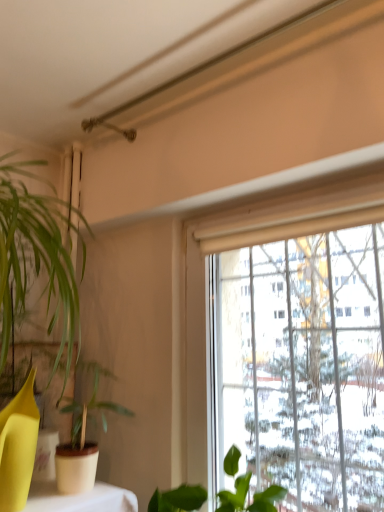
The width and height of the screenshot is (384, 512). What do you see at coordinates (82, 440) in the screenshot?
I see `green matte plant at left, the second houseplant in the right-to-left sequence` at bounding box center [82, 440].

Locate an element on the screen. green matte plant at left, the 1th houseplant positioned from the left is located at coordinates (82, 440).

What do you see at coordinates (246, 495) in the screenshot?
I see `green matte leafy plant at lower center, the first houseplant in the right-to-left sequence` at bounding box center [246, 495].

In order to face green matte leafy plant at lower center, the first houseplant in the right-to-left sequence, should I rotate leftwards or rightwards?

A 0.784 degree turn to the right will do.

Measure the distance between point (247, 509) and camera.

Point (247, 509) is 3.83 feet from camera.

What is the approximate width of green matte leafy plant at lower center, the first houseplant in the right-to-left sequence?

It is 10.95 inches.

Where is `green matte leafy plant at lower center, the first houseplant in the right-to-left sequence`? This screenshot has width=384, height=512. green matte leafy plant at lower center, the first houseplant in the right-to-left sequence is located at coordinates (246, 495).

What are the coordinates of `green matte plant at left, the second houseplant in the right-to-left sequence` in the screenshot? It's located at (82, 440).

In the scene shown: In the image, is green matte plant at left, the 1th houseplant positioned from the left, on the left side or the right side of green matte leafy plant at lower center, the first houseplant in the right-to-left sequence?

green matte plant at left, the 1th houseplant positioned from the left, is positioned on green matte leafy plant at lower center, the first houseplant in the right-to-left sequence,'s left side.

Who is more distant, green matte plant at left, the 1th houseplant positioned from the left, or green matte leafy plant at lower center, the first houseplant in the right-to-left sequence?

Positioned behind is green matte plant at left, the 1th houseplant positioned from the left.

Does point (78, 413) appear closer or farther from the camera than point (272, 490)?

Point (78, 413) is positioned farther from the camera compared to point (272, 490).

From the image's perspective, which is above, green matte plant at left, the 1th houseplant positioned from the left, or green matte leafy plant at lower center, the first houseplant in the right-to-left sequence?

green matte plant at left, the 1th houseplant positioned from the left.

Based on the photo, from a real-world perspective, does green matte plant at left, the second houseplant in the right-to-left sequence, stand above green matte leafy plant at lower center, arranged as the 2th houseplant when viewed from the left?

Yes, from a real-world perspective, green matte plant at left, the second houseplant in the right-to-left sequence, is above green matte leafy plant at lower center, arranged as the 2th houseplant when viewed from the left.

Considering the sizes of objects green matte plant at left, the second houseplant in the right-to-left sequence, and green matte leafy plant at lower center, the first houseplant in the right-to-left sequence, in the image provided, who is wider, green matte plant at left, the second houseplant in the right-to-left sequence, or green matte leafy plant at lower center, the first houseplant in the right-to-left sequence,?

green matte leafy plant at lower center, the first houseplant in the right-to-left sequence.

Considering the sizes of objects green matte plant at left, the second houseplant in the right-to-left sequence, and green matte leafy plant at lower center, the first houseplant in the right-to-left sequence, in the image provided, who is shorter, green matte plant at left, the second houseplant in the right-to-left sequence, or green matte leafy plant at lower center, the first houseplant in the right-to-left sequence,?

Standing shorter between the two is green matte leafy plant at lower center, the first houseplant in the right-to-left sequence.

Considering the sizes of objects green matte plant at left, the second houseplant in the right-to-left sequence, and green matte leafy plant at lower center, the first houseplant in the right-to-left sequence, in the image provided, who is smaller, green matte plant at left, the second houseplant in the right-to-left sequence, or green matte leafy plant at lower center, the first houseplant in the right-to-left sequence,?

With smaller size is green matte plant at left, the second houseplant in the right-to-left sequence.

Is green matte leafy plant at lower center, the first houseplant in the right-to-left sequence, completely or partially inside green matte plant at left, the second houseplant in the right-to-left sequence?

No, green matte leafy plant at lower center, the first houseplant in the right-to-left sequence, is not inside green matte plant at left, the second houseplant in the right-to-left sequence.

Is green matte plant at left, the second houseplant in the right-to-left sequence, far away from green matte leafy plant at lower center, the first houseplant in the right-to-left sequence?

No, there isn't a large distance between green matte plant at left, the second houseplant in the right-to-left sequence, and green matte leafy plant at lower center, the first houseplant in the right-to-left sequence.

Is green matte plant at left, the second houseplant in the right-to-left sequence, turned away from green matte leafy plant at lower center, arranged as the 2th houseplant when viewed from the left?

green matte plant at left, the second houseplant in the right-to-left sequence, does not have its back to green matte leafy plant at lower center, arranged as the 2th houseplant when viewed from the left.

The width and height of the screenshot is (384, 512). In order to click on houseplant in front of the green matte plant at left, the 1th houseplant positioned from the left in this screenshot , I will do `click(246, 495)`.

Would you say green matte leafy plant at lower center, arranged as the 2th houseplant when viewed from the left, is to the left or to the right of green matte plant at left, the 1th houseplant positioned from the left, in the picture?

green matte leafy plant at lower center, arranged as the 2th houseplant when viewed from the left, is to the right of green matte plant at left, the 1th houseplant positioned from the left.

Considering their positions, is green matte leafy plant at lower center, the first houseplant in the right-to-left sequence, located in front of or behind green matte plant at left, the 1th houseplant positioned from the left?

green matte leafy plant at lower center, the first houseplant in the right-to-left sequence, is positioned closer to the viewer than green matte plant at left, the 1th houseplant positioned from the left.

Which is behind, point (242, 504) or point (82, 453)?

The point (82, 453) is more distant.

From the image's perspective, which is below, green matte leafy plant at lower center, arranged as the 2th houseplant when viewed from the left, or green matte plant at left, the 1th houseplant positioned from the left?

green matte leafy plant at lower center, arranged as the 2th houseplant when viewed from the left, appears lower in the image.

From a real-world perspective, is green matte leafy plant at lower center, arranged as the 2th houseplant when viewed from the left, positioned above or below green matte plant at left, the second houseplant in the right-to-left sequence?

green matte leafy plant at lower center, arranged as the 2th houseplant when viewed from the left, is situated lower than green matte plant at left, the second houseplant in the right-to-left sequence, in the real world.

Can you confirm if green matte leafy plant at lower center, arranged as the 2th houseplant when viewed from the left, is thinner than green matte plant at left, the second houseplant in the right-to-left sequence?

Incorrect, the width of green matte leafy plant at lower center, arranged as the 2th houseplant when viewed from the left, is not less than that of green matte plant at left, the second houseplant in the right-to-left sequence.

Can you confirm if green matte leafy plant at lower center, the first houseplant in the right-to-left sequence, is shorter than green matte plant at left, the second houseplant in the right-to-left sequence?

Yes, green matte leafy plant at lower center, the first houseplant in the right-to-left sequence, is shorter than green matte plant at left, the second houseplant in the right-to-left sequence.

Is green matte leafy plant at lower center, arranged as the 2th houseplant when viewed from the left, bigger than green matte plant at left, the 1th houseplant positioned from the left?

Correct, green matte leafy plant at lower center, arranged as the 2th houseplant when viewed from the left, is larger in size than green matte plant at left, the 1th houseplant positioned from the left.

Does green matte leafy plant at lower center, the first houseplant in the right-to-left sequence, contain green matte plant at left, the 1th houseplant positioned from the left?

No, green matte leafy plant at lower center, the first houseplant in the right-to-left sequence, does not contain green matte plant at left, the 1th houseplant positioned from the left.

Could you tell me if green matte leafy plant at lower center, the first houseplant in the right-to-left sequence, is facing green matte plant at left, the 1th houseplant positioned from the left?

No, green matte leafy plant at lower center, the first houseplant in the right-to-left sequence, is not oriented towards green matte plant at left, the 1th houseplant positioned from the left.

How many degrees apart are the facing directions of green matte leafy plant at lower center, the first houseplant in the right-to-left sequence, and green matte plant at left, the 1th houseplant positioned from the left?

86 degrees.

Identify the location of houseplant above the green matte leafy plant at lower center, arranged as the 2th houseplant when viewed from the left (from a real-world perspective). The image size is (384, 512). (82, 440).

Find the location of a particular element. The image size is (384, 512). houseplant above the green matte leafy plant at lower center, arranged as the 2th houseplant when viewed from the left (from a real-world perspective) is located at coordinates (82, 440).

Identify the location of houseplant on the right of green matte plant at left, the second houseplant in the right-to-left sequence. Image resolution: width=384 pixels, height=512 pixels. (246, 495).